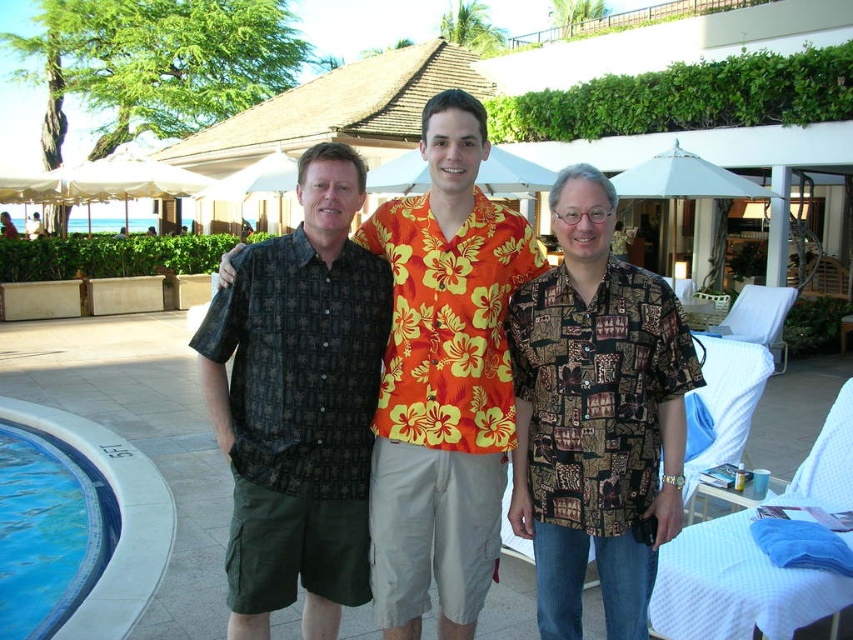
Based on the photo, you are a photographer standing at the poolside. You need to capture a photo that includes both the dark brown patterned shirt at center and the blue tile swimming pool at lower left. Which object should be placed higher in the frame to ensure both are visible?

The dark brown patterned shirt at center should be placed higher in the frame because it is positioned above the blue tile swimming pool at lower left.

You are a photographer setting up for a group photo. You need to ensure there is enough space between the dark brown patterned shirt at center and the printed fabric shirt at center to avoid overlapping in the shot. Given that your camera has a minimum focus distance of 36 inches, will the current spacing between them allow for a clear, non overlapping photo?

The dark brown patterned shirt at center is 36.86 inches from the printed fabric shirt at center. Since the minimum focus distance is 36 inches, the current spacing of 36.86 inches is sufficient to avoid overlap and capture both subjects clearly.